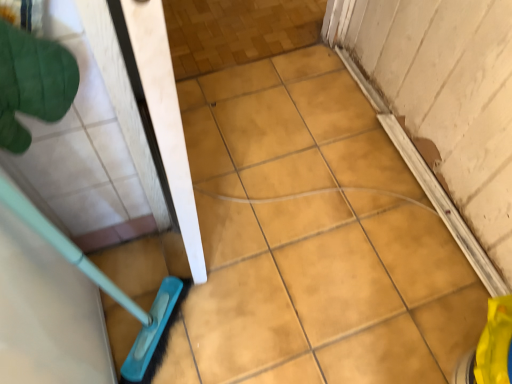
Question: Is yellow matte tile at lower right, the first ceramic tile in the right-to-left sequence, behind green fabric glove at upper left?

Choices:
 (A) yes
 (B) no

Answer: (A)

Question: Is yellow matte tile at lower right, the first ceramic tile in the right-to-left sequence, thinner than green fabric glove at upper left?

Choices:
 (A) yes
 (B) no

Answer: (B)

Question: Considering the relative sizes of yellow matte tile at lower right, the first ceramic tile in the right-to-left sequence, and green fabric glove at upper left in the image provided, is yellow matte tile at lower right, the first ceramic tile in the right-to-left sequence, wider than green fabric glove at upper left?

Choices:
 (A) yes
 (B) no

Answer: (A)

Question: Can you confirm if yellow matte tile at lower right, the first ceramic tile in the right-to-left sequence, is smaller than green fabric glove at upper left?

Choices:
 (A) no
 (B) yes

Answer: (A)

Question: Considering the relative sizes of yellow matte tile at lower right, the first ceramic tile in the right-to-left sequence, and green fabric glove at upper left in the image provided, is yellow matte tile at lower right, the first ceramic tile in the right-to-left sequence, bigger than green fabric glove at upper left?

Choices:
 (A) yes
 (B) no

Answer: (A)

Question: Relative to yellow matte tile at lower right, the first ceramic tile in the right-to-left sequence, is green fabric glove at upper left in front or behind?

Choices:
 (A) front
 (B) behind

Answer: (A)

Question: Considering the relative positions of green fabric glove at upper left and yellow matte tile at lower right, the first ceramic tile in the right-to-left sequence, in the image provided, is green fabric glove at upper left to the left or to the right of yellow matte tile at lower right, the first ceramic tile in the right-to-left sequence,?

Choices:
 (A) left
 (B) right

Answer: (A)

Question: Which is correct: green fabric glove at upper left is inside yellow matte tile at lower right, the first ceramic tile in the right-to-left sequence, or outside of it?

Choices:
 (A) outside
 (B) inside

Answer: (A)

Question: Is green fabric glove at upper left wider or thinner than yellow matte tile at lower right, the first ceramic tile in the right-to-left sequence?

Choices:
 (A) wide
 (B) thin

Answer: (B)

Question: Considering the positions of yellow matte tile at center, placed as the second ceramic tile when sorted from right to left, and green fabric glove at upper left in the image, is yellow matte tile at center, placed as the second ceramic tile when sorted from right to left, taller or shorter than green fabric glove at upper left?

Choices:
 (A) tall
 (B) short

Answer: (B)

Question: In the image, is yellow matte tile at center, which is counted as the 1th ceramic tile, starting from the left, positioned in front of or behind green fabric glove at upper left?

Choices:
 (A) behind
 (B) front

Answer: (A)

Question: In terms of size, does yellow matte tile at center, placed as the second ceramic tile when sorted from right to left, appear bigger or smaller than green fabric glove at upper left?

Choices:
 (A) big
 (B) small

Answer: (A)

Question: Is yellow matte tile at center, placed as the second ceramic tile when sorted from right to left, inside or outside of green fabric glove at upper left?

Choices:
 (A) inside
 (B) outside

Answer: (B)

Question: Considering the positions of yellow matte tile at lower right, which appears as the 2th ceramic tile when viewed from the left, and green fabric glove at upper left in the image, is yellow matte tile at lower right, which appears as the 2th ceramic tile when viewed from the left, taller or shorter than green fabric glove at upper left?

Choices:
 (A) tall
 (B) short

Answer: (A)

Question: From the image's perspective, relative to green fabric glove at upper left, is yellow matte tile at lower right, which appears as the 2th ceramic tile when viewed from the left, above or below?

Choices:
 (A) below
 (B) above

Answer: (A)